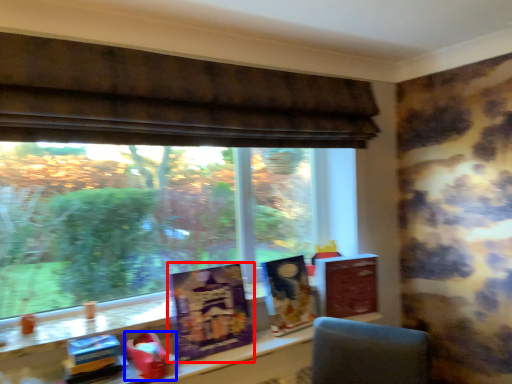
Question: Which point is closer to the camera, paperback book (highlighted by a red box) or toy (highlighted by a blue box)?

Choices:
 (A) paperback book
 (B) toy

Answer: (B)